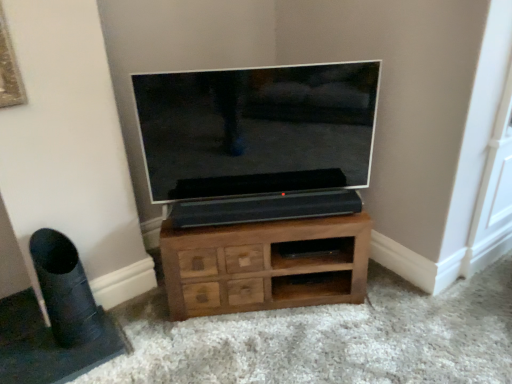
The width and height of the screenshot is (512, 384). What do you see at coordinates (257, 129) in the screenshot?
I see `flat screen tv at center` at bounding box center [257, 129].

What do you see at coordinates (265, 265) in the screenshot? The image size is (512, 384). I see `brown wood chest of drawers at center` at bounding box center [265, 265].

The width and height of the screenshot is (512, 384). What are the coordinates of `black matte speaker at lower left` in the screenshot? It's located at (64, 289).

Locate an element on the screen. Image resolution: width=512 pixels, height=384 pixels. flat screen tv at center is located at coordinates (257, 129).

Does black matte speaker at lower left have a lesser height compared to flat screen tv at center?

Correct, black matte speaker at lower left is not as tall as flat screen tv at center.

Can we say black matte speaker at lower left lies outside flat screen tv at center?

black matte speaker at lower left is positioned outside flat screen tv at center.

Can you see black matte speaker at lower left touching flat screen tv at center?

black matte speaker at lower left and flat screen tv at center are not in contact.

Is the depth of flat screen tv at center greater than that of black matte speaker at lower left?

Yes, flat screen tv at center is further from the camera.

Is black matte speaker at lower left at the back of flat screen tv at center?

No, flat screen tv at center is not facing the opposite direction of black matte speaker at lower left.

Is black matte speaker at lower left completely or partially inside flat screen tv at center?

No.

Can you confirm if brown wood chest of drawers at center is shorter than flat screen tv at center?

Yes.

Considering the positions of point (251, 297) and point (303, 188), is point (251, 297) closer or farther from the camera than point (303, 188)?

Point (251, 297) appears to be closer to the viewer than point (303, 188).

I want to click on television that is in front of the brown wood chest of drawers at center, so click(257, 129).

From a real-world perspective, does flat screen tv at center stand above brown wood chest of drawers at center?

Yes, from a real-world perspective, flat screen tv at center is over brown wood chest of drawers at center

Is flat screen tv at center next to brown wood chest of drawers at center and touching it?

There is a gap between flat screen tv at center and brown wood chest of drawers at center.

Is flat screen tv at center facing towards brown wood chest of drawers at center?

No.

From a real-world perspective, between black matte speaker at lower left and brown wood chest of drawers at center, who is vertically lower?

brown wood chest of drawers at center is physically lower.

Considering the relative positions of black matte speaker at lower left and brown wood chest of drawers at center in the image provided, is black matte speaker at lower left to the left of brown wood chest of drawers at center from the viewer's perspective?

Yes, black matte speaker at lower left is to the left of brown wood chest of drawers at center.

Could you tell me if black matte speaker at lower left is facing brown wood chest of drawers at center?

No.

Identify the location of speaker on the left of brown wood chest of drawers at center. Image resolution: width=512 pixels, height=384 pixels. (64, 289).

Who is shorter, brown wood chest of drawers at center or black matte speaker at lower left?

brown wood chest of drawers at center.

Which object is wider, brown wood chest of drawers at center or black matte speaker at lower left?

With larger width is brown wood chest of drawers at center.

Is point (275, 225) less distant than point (98, 316)?

Yes, point (275, 225) is closer to viewer.

Where is `television above the black matte speaker at lower left (from the image's perspective)`? television above the black matte speaker at lower left (from the image's perspective) is located at coordinates (257, 129).

Where is `speaker lying on the left of flat screen tv at center`? The image size is (512, 384). speaker lying on the left of flat screen tv at center is located at coordinates (64, 289).

Estimate the real-world distances between objects in this image. Which object is further from brown wood chest of drawers at center, flat screen tv at center or black matte speaker at lower left?

The object further to brown wood chest of drawers at center is black matte speaker at lower left.

Looking at the image, which one is located further to flat screen tv at center, brown wood chest of drawers at center or black matte speaker at lower left?

black matte speaker at lower left is further to flat screen tv at center.

Which object lies nearer to the anchor point flat screen tv at center, black matte speaker at lower left or brown wood chest of drawers at center?

brown wood chest of drawers at center is positioned closer to the anchor flat screen tv at center.

From the image, which object appears to be farther from black matte speaker at lower left, flat screen tv at center or brown wood chest of drawers at center?

flat screen tv at center is further to black matte speaker at lower left.

Considering their positions, is brown wood chest of drawers at center positioned further to black matte speaker at lower left than flat screen tv at center?

The object further to black matte speaker at lower left is flat screen tv at center.

Considering their positions, is black matte speaker at lower left positioned further to brown wood chest of drawers at center than flat screen tv at center?

Based on the image, black matte speaker at lower left appears to be further to brown wood chest of drawers at center.

Find the location of `television between black matte speaker at lower left and brown wood chest of drawers at center from left to right`. television between black matte speaker at lower left and brown wood chest of drawers at center from left to right is located at coordinates (257, 129).